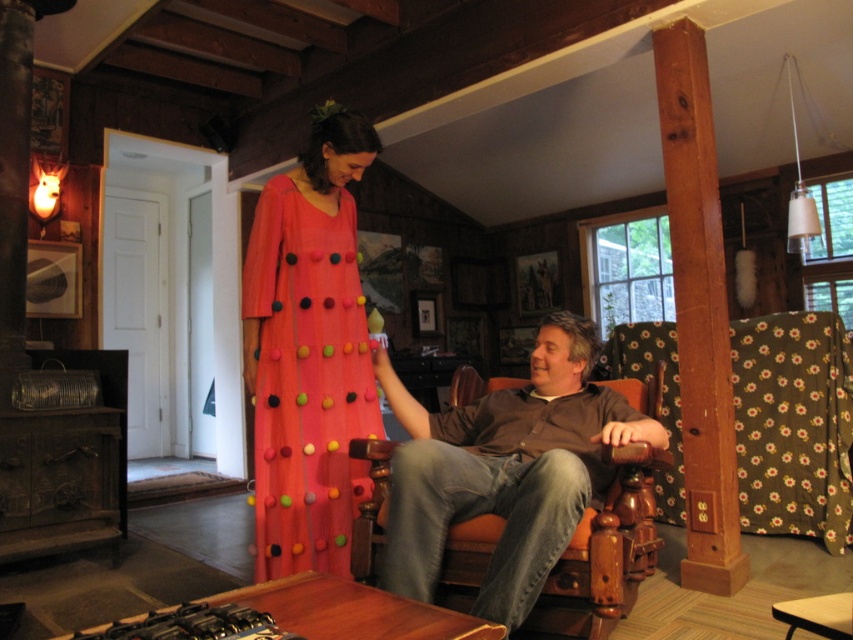
Measure the distance between brown leather chair at center and matte coral dress at center.

They are 19.57 inches apart.

Between point (463, 477) and point (326, 488), which one is positioned in front?

Point (463, 477)

Find the location of a particular element. brown leather chair at center is located at coordinates (505, 470).